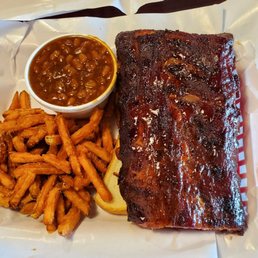
At what (x,y) coordinates should I click in order to perform the action: click on surface. Please return your answer as a coordinate pair (x, y). The width and height of the screenshot is (258, 258). Looking at the image, I should click on (163, 8).